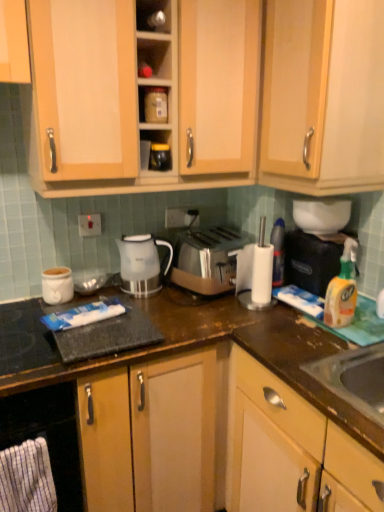
Locate an element on the screen. free space above wooden cabinet at center, arranged as the 3th cabinetry when viewed from the top (from a real-world perspective) is located at coordinates (79, 304).